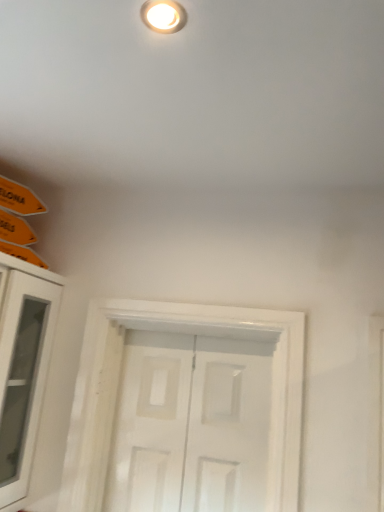
Question: Considering the relative sizes of white matte door at center and white glass cabinet at left in the image provided, is white matte door at center thinner than white glass cabinet at left?

Choices:
 (A) yes
 (B) no

Answer: (A)

Question: Is white matte door at center facing away from white glass cabinet at left?

Choices:
 (A) no
 (B) yes

Answer: (A)

Question: Is white glass cabinet at left surrounded by white matte door at center?

Choices:
 (A) no
 (B) yes

Answer: (A)

Question: From the image's perspective, is white matte door at center beneath white glass cabinet at left?

Choices:
 (A) yes
 (B) no

Answer: (A)

Question: From a real-world perspective, is white matte door at center under white glass cabinet at left?

Choices:
 (A) yes
 (B) no

Answer: (A)

Question: Can we say white matte door at center lies outside white glass cabinet at left?

Choices:
 (A) yes
 (B) no

Answer: (A)

Question: Considering the relative sizes of white glass cabinet at left and white matte door at center in the image provided, is white glass cabinet at left smaller than white matte door at center?

Choices:
 (A) no
 (B) yes

Answer: (A)

Question: From a real-world perspective, is white glass cabinet at left positioned over white matte door at center based on gravity?

Choices:
 (A) yes
 (B) no

Answer: (A)

Question: Can you confirm if white glass cabinet at left is taller than white matte door at center?

Choices:
 (A) yes
 (B) no

Answer: (A)

Question: Is white glass cabinet at left at the left side of white matte door at center?

Choices:
 (A) yes
 (B) no

Answer: (A)

Question: Does white glass cabinet at left lie in front of white matte door at center?

Choices:
 (A) yes
 (B) no

Answer: (A)

Question: From a real-world perspective, is white glass cabinet at left positioned under white matte door at center based on gravity?

Choices:
 (A) no
 (B) yes

Answer: (A)

Question: From a real-world perspective, relative to white glass cabinet at left, is white matte door at center vertically above or below?

Choices:
 (A) below
 (B) above

Answer: (A)